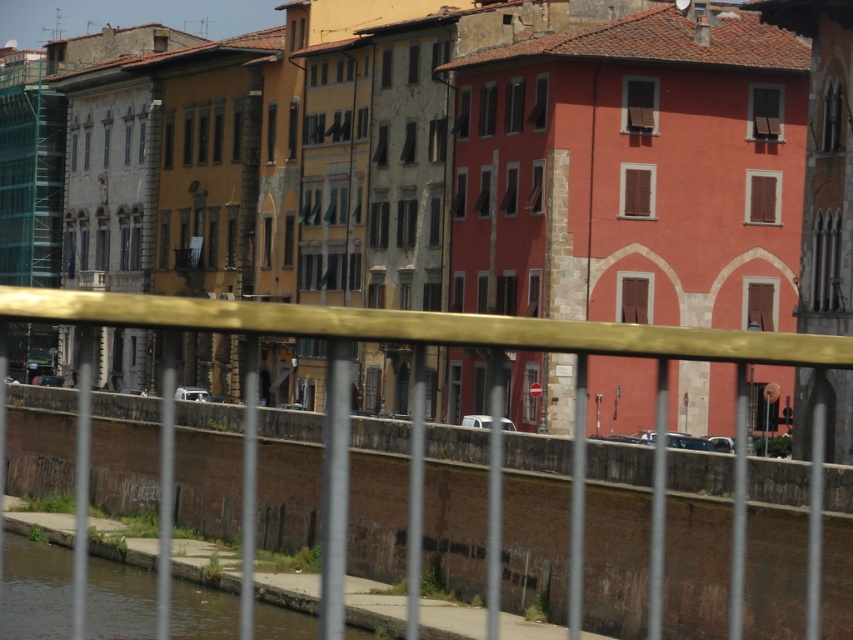
Looking at this image, you are a tourist standing on the bridge overlooking the canal. You want to know the distance between the gold metallic fence at center and the brown concrete river at lower left. Can you estimate it based on the scene?

The gold metallic fence at center is 8.58 meters from the brown concrete river at lower left.

You are standing on a bridge overlooking the canal and want to take a photo of the gold metallic fence at center. According to the scene description, where should you position your camera to capture the fence in the center of your photo?

A: To capture the gold metallic fence at center in the center of your photo, position your camera so that the fence aligns with the center point of your viewfinder or screen, which corresponds to the coordinate point mentioned in the description.

You are standing at the edge of a canal in a European city and see the gold metallic fence at center and the brown concrete river at lower left. Which object is closer to you?

The gold metallic fence at center is closer to you because it is located above the brown concrete river at lower left, which is further away.